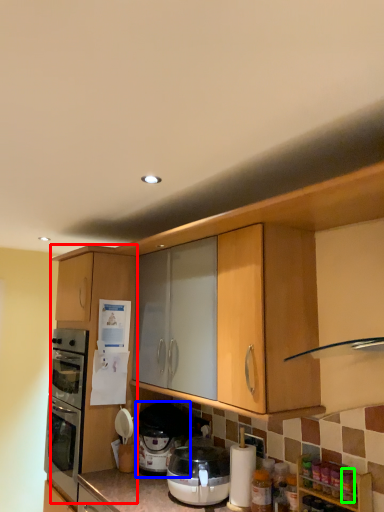
Question: Which is farther away from cabinetry (highlighted by a red box)? pressure cooker (highlighted by a blue box) or bottle (highlighted by a green box)?

Choices:
 (A) pressure cooker
 (B) bottle

Answer: (B)